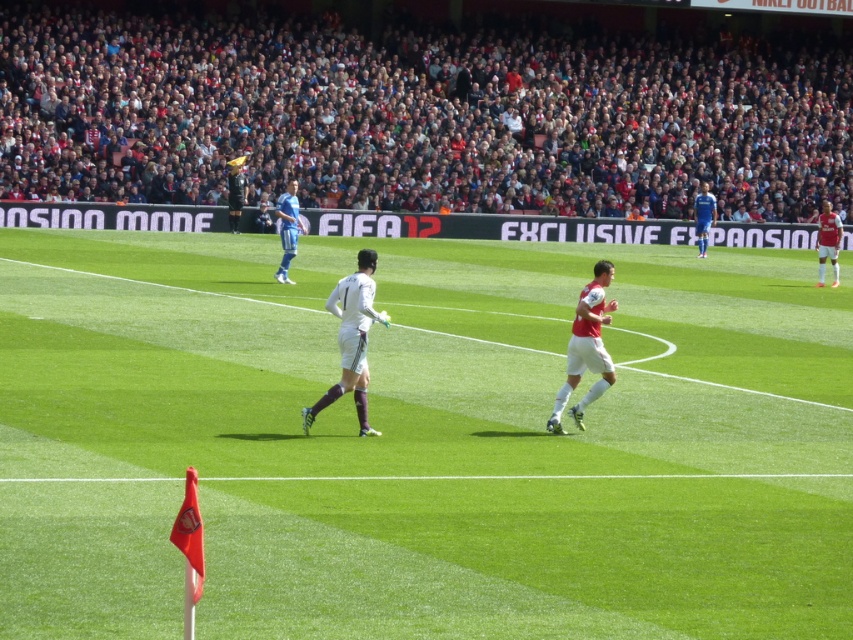
Question: Does blue striped jersey at center appear on the left side of black jersey at upper center?

Choices:
 (A) yes
 (B) no

Answer: (B)

Question: Does white smooth soccer player at center appear under white jersey at right?

Choices:
 (A) no
 (B) yes

Answer: (B)

Question: Which point is farther to the camera?

Choices:
 (A) white cotton crowd at upper center
 (B) blue striped jersey at center
 (C) blue jersey at right

Answer: (A)

Question: In this image, where is white cotton crowd at upper center located relative to black jersey at upper center?

Choices:
 (A) right
 (B) left

Answer: (A)

Question: Which of these objects is positioned farthest from the green grass field at center?

Choices:
 (A) blue striped jersey at center
 (B) white jersey at right
 (C) white smooth soccer player at center
 (D) white matte jersey at center

Answer: (B)

Question: Among these points, which one is nearest to the camera?

Choices:
 (A) (708, 212)
 (B) (288, 278)
 (C) (344, 380)

Answer: (C)